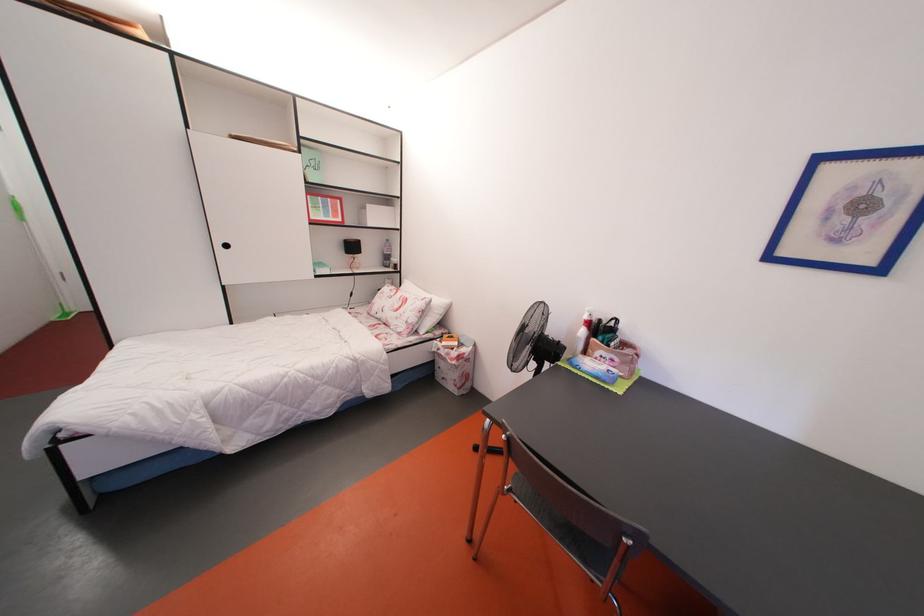
The width and height of the screenshot is (924, 616). What do you see at coordinates (428, 306) in the screenshot?
I see `the white pillow` at bounding box center [428, 306].